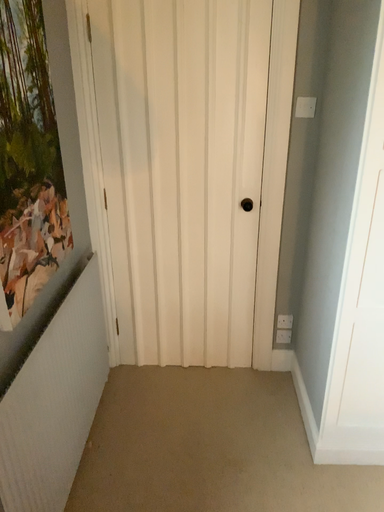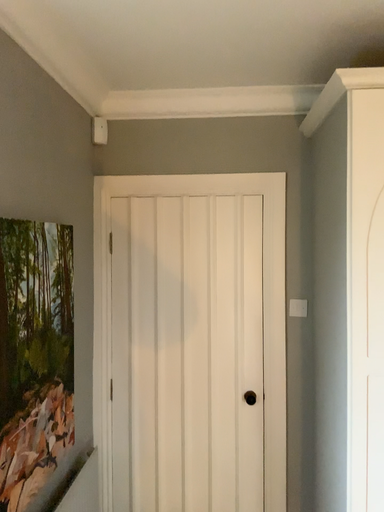
Question: How did the camera likely rotate when shooting the video?

Choices:
 (A) rotated upward
 (B) rotated downward

Answer: (A)